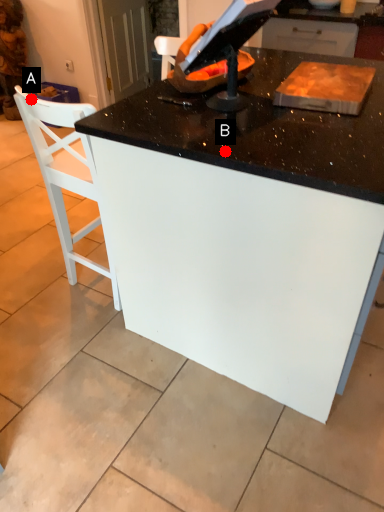
Question: Two points are circled on the image, labeled by A and B beside each circle. Which point is farther to the camera?

Choices:
 (A) A is further
 (B) B is further

Answer: (A)